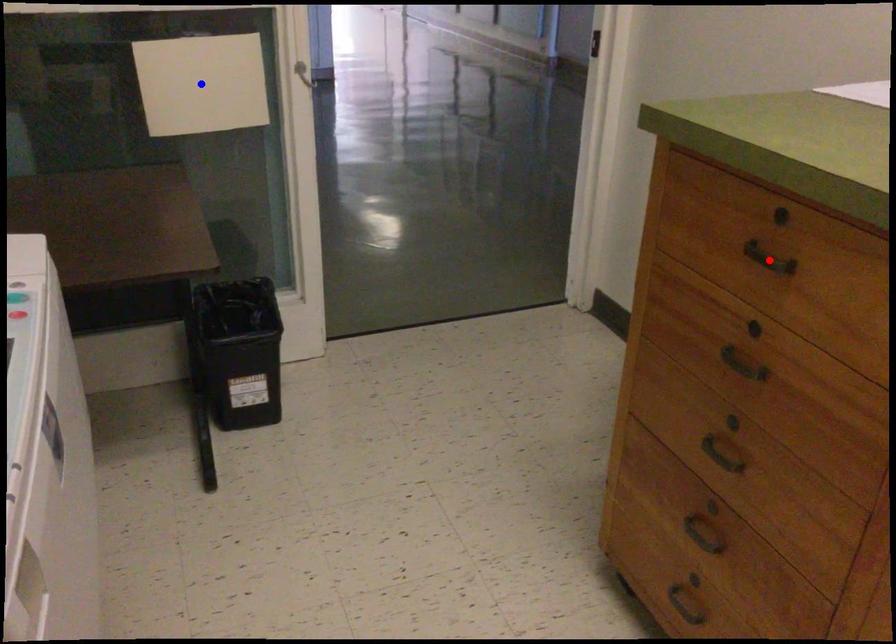
Question: Which of the two points in the image is closer to the camera?

Choices:
 (A) Blue point is closer.
 (B) Red point is closer.

Answer: (B)